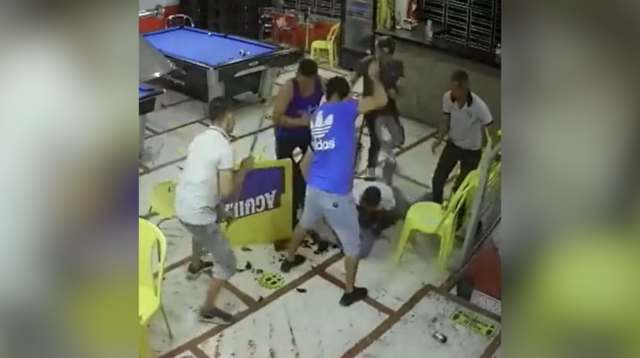
Identify the location of metal leg on yellow chair. Image resolution: width=640 pixels, height=358 pixels. (166, 319).